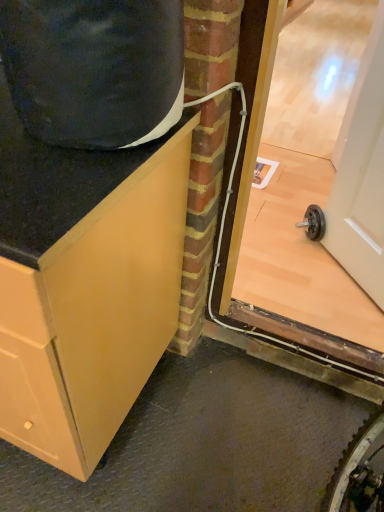
Find the location of `white glossy door at upper right`. white glossy door at upper right is located at coordinates (361, 175).

Identify the location of transparent glass door at right. (306, 178).

Is there a large distance between white glossy door at upper right and matte wood cabinet at left?

white glossy door at upper right is far away from matte wood cabinet at left.

Considering the relative sizes of white glossy door at upper right and matte wood cabinet at left in the image provided, is white glossy door at upper right smaller than matte wood cabinet at left?

Indeed, white glossy door at upper right has a smaller size compared to matte wood cabinet at left.

From a real-world perspective, is white glossy door at upper right located beneath matte wood cabinet at left?

Incorrect, from a real-world perspective, white glossy door at upper right is higher than matte wood cabinet at left.

Is white glossy door at upper right at the right side of matte wood cabinet at left?

Yes.

Between matte wood cabinet at left and white glossy door at upper right, which one has larger width?

With larger width is matte wood cabinet at left.

Which object is more forward, matte wood cabinet at left or white glossy door at upper right?

matte wood cabinet at left.

Is matte wood cabinet at left placed right next to white glossy door at upper right?

No, matte wood cabinet at left is not with white glossy door at upper right.

Measure the distance from matte wood cabinet at left to white glossy door at upper right.

matte wood cabinet at left is 3.40 feet away from white glossy door at upper right.

In the scene shown: Is matte wood cabinet at left oriented away from transparent glass door at right?

No, transparent glass door at right is not at the back of matte wood cabinet at left.

Is matte wood cabinet at left not inside transparent glass door at right?

Absolutely, matte wood cabinet at left is external to transparent glass door at right.

From the image's perspective, which object appears higher, matte wood cabinet at left or transparent glass door at right?

transparent glass door at right is shown above in the image.

Considering the positions of point (78, 254) and point (274, 125), is point (78, 254) closer or farther from the camera than point (274, 125)?

Point (78, 254) is positioned closer to the camera compared to point (274, 125).

Considering the points (301, 258) and (358, 88), which point is behind, point (301, 258) or point (358, 88)?

The point (358, 88) is farther.

Can you confirm if transparent glass door at right is taller than white glossy door at upper right?

Yes.

Choose the correct answer: Is transparent glass door at right inside white glossy door at upper right or outside it?

transparent glass door at right is not inside white glossy door at upper right, it's outside.

Could you tell me if transparent glass door at right is turned towards white glossy door at upper right?

No, transparent glass door at right is not facing towards white glossy door at upper right.

Does transparent glass door at right have a lesser width compared to matte wood cabinet at left?

Correct, the width of transparent glass door at right is less than that of matte wood cabinet at left.

From a real-world perspective, is transparent glass door at right located beneath matte wood cabinet at left?

No, from a real-world perspective, transparent glass door at right is not beneath matte wood cabinet at left.

Is the depth of transparent glass door at right greater than that of matte wood cabinet at left?

Yes, the depth of transparent glass door at right is greater than that of matte wood cabinet at left.

Between white glossy door at upper right and transparent glass door at right, which one has smaller size?

white glossy door at upper right.

From the image's perspective, which object appears higher, white glossy door at upper right or transparent glass door at right?

white glossy door at upper right is shown above in the image.

Does point (383, 284) appear closer or farther from the camera than point (320, 244)?

Point (383, 284) appears to be closer to the viewer than point (320, 244).

This screenshot has width=384, height=512. Identify the location of door located above the transparent glass door at right (from the image's perspective). (361, 175).

I want to click on door lying above the matte wood cabinet at left (from the image's perspective), so click(x=361, y=175).

The width and height of the screenshot is (384, 512). Identify the location of door behind the matte wood cabinet at left. (361, 175).

From the image, which object appears to be nearer to transparent glass door at right, white glossy door at upper right or matte wood cabinet at left?

white glossy door at upper right lies closer to transparent glass door at right than the other object.

When comparing their distances from matte wood cabinet at left, does transparent glass door at right or white glossy door at upper right seem further?

transparent glass door at right lies further to matte wood cabinet at left than the other object.

Which object lies nearer to the anchor point matte wood cabinet at left, white glossy door at upper right or transparent glass door at right?

white glossy door at upper right lies closer to matte wood cabinet at left than the other object.

Looking at the image, which one is located closer to transparent glass door at right, matte wood cabinet at left or white glossy door at upper right?

white glossy door at upper right is positioned closer to the anchor transparent glass door at right.

Based on their spatial positions, is matte wood cabinet at left or transparent glass door at right further from white glossy door at upper right?

matte wood cabinet at left is positioned further to the anchor white glossy door at upper right.

Looking at the image, which one is located further to white glossy door at upper right, transparent glass door at right or matte wood cabinet at left?

matte wood cabinet at left.

Locate an element on the screen. This screenshot has width=384, height=512. glass door between matte wood cabinet at left and white glossy door at upper right in the horizontal direction is located at coordinates pyautogui.click(x=306, y=178).